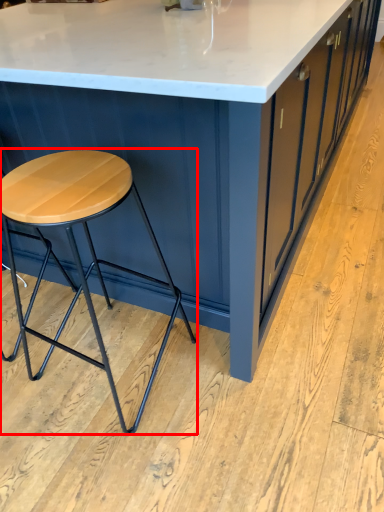
Question: From the image's perspective, where is stool (annotated by the red box) located in relation to table in the image?

Choices:
 (A) above
 (B) below

Answer: (B)